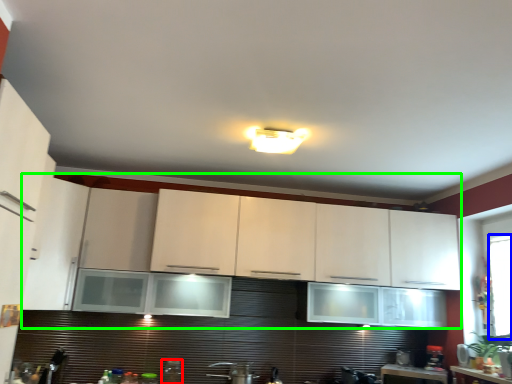
Question: Which object is positioned farthest from appliance (highlighted by a red box)? Select from window screen (highlighted by a blue box) and cabinetry (highlighted by a green box).

Choices:
 (A) window screen
 (B) cabinetry

Answer: (A)